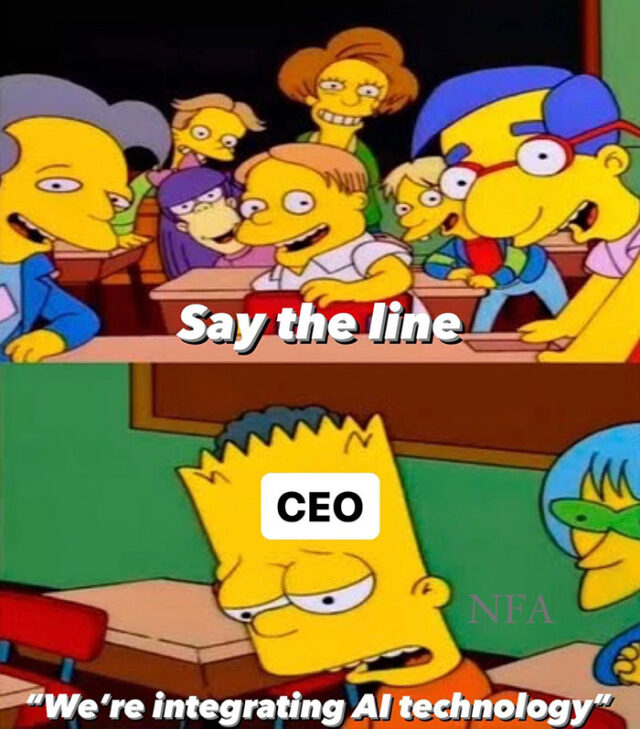
This screenshot has width=640, height=729. What are the coordinates of `blackboard` in the screenshot? It's located at (188, 42).